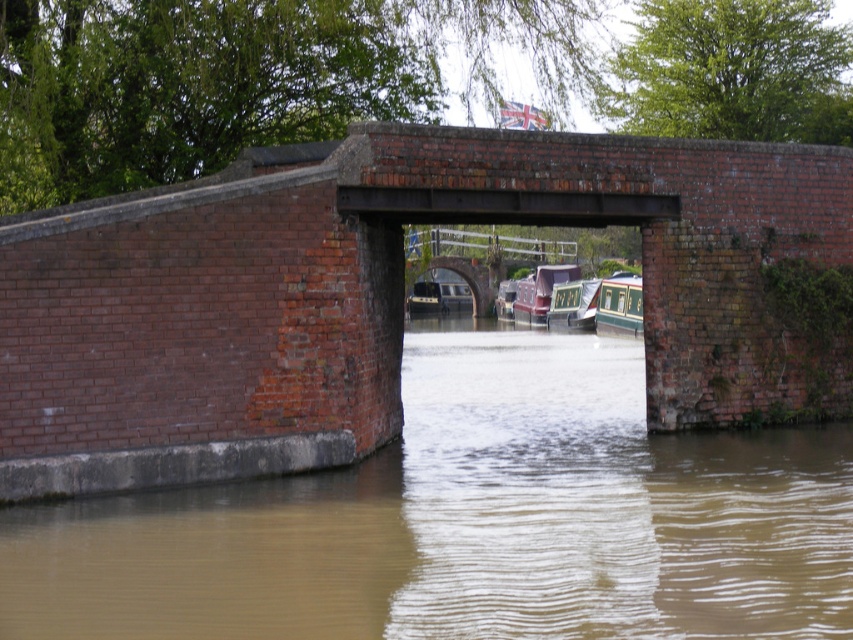
You are a delivery drone that needs to fly from the brown muddy water at center to the green glossy boat at center. What is the minimum distance you need to cover?

The minimum distance between the brown muddy water at center and the green glossy boat at center is 27.86 meters, so the drone needs to cover at least 27.86 meters.

You are a photographer trying to capture the maroon glossy boat at center in your shot. The brown muddy water at center is blocking part of the boat. Can you adjust your angle to see the entire boat without the water blocking it?

The brown muddy water at center is shorter than the maroon glossy boat at center, so yes, you can adjust your angle to see the entire boat since the water is lower than the boat.

You are a photographer standing at the edge of the canal. You want to capture a clear shot of the brown muddy water at center. Considering the distance between you and the water, what is the minimum focal length lens you should use to ensure the entire water surface fits within your frame?

The minimum focal length lens required to capture the entire brown muddy water at center within the frame would depend on the camera sensor size and field of view. However, since the distance between you and the water is 10.03 meters, a lens with a focal length of at least 50mm on a full frame camera would provide a sufficient field of view to include the entire water surface in the composition.